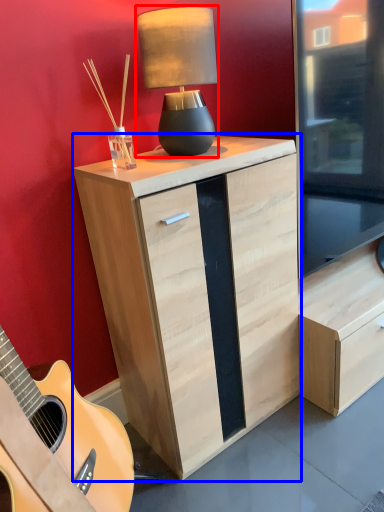
Question: Which of the following is the closest to the observer, lamp (highlighted by a red box) or chest of drawers (highlighted by a blue box)?

Choices:
 (A) lamp
 (B) chest of drawers

Answer: (B)